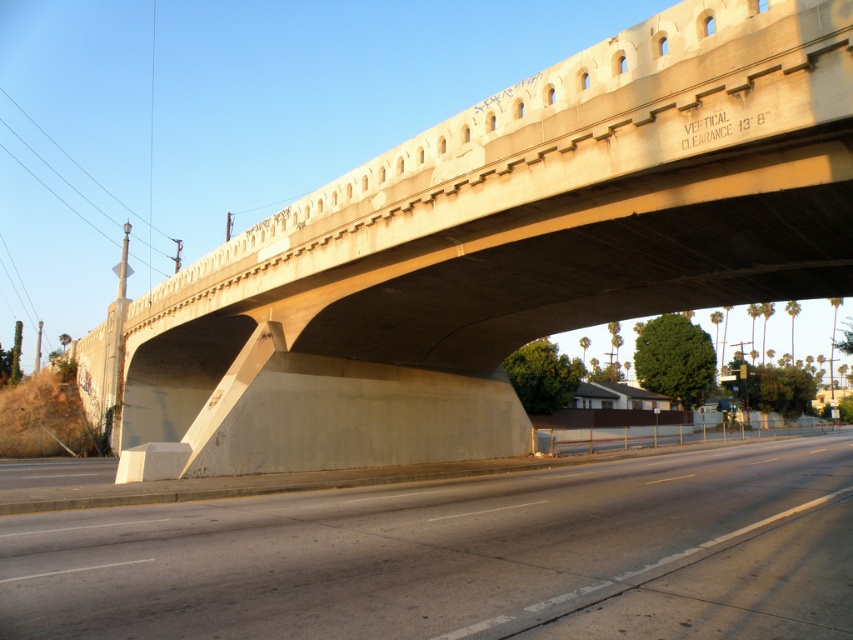
Is concrete bridge at center to the right of gray concrete highway at lower center from the viewer's perspective?

In fact, concrete bridge at center is to the left of gray concrete highway at lower center.

Is concrete bridge at center shorter than gray concrete highway at lower center?

Incorrect, concrete bridge at center's height does not fall short of gray concrete highway at lower center's.

The width and height of the screenshot is (853, 640). Describe the element at coordinates (498, 250) in the screenshot. I see `concrete bridge at center` at that location.

The width and height of the screenshot is (853, 640). Find the location of `concrete bridge at center`. concrete bridge at center is located at coordinates (498, 250).